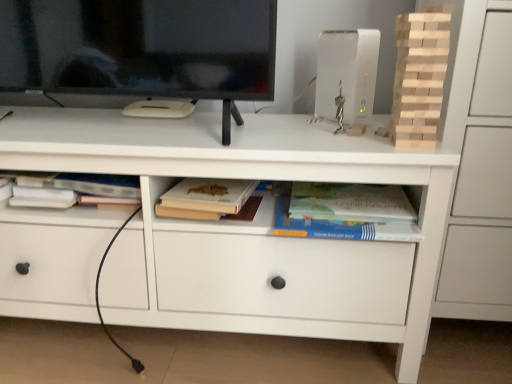
This screenshot has height=384, width=512. In order to click on blank space situated above hardcover book at center, acting as the second paperback book starting from the left (from a real-world perspective) in this screenshot , I will do `click(347, 196)`.